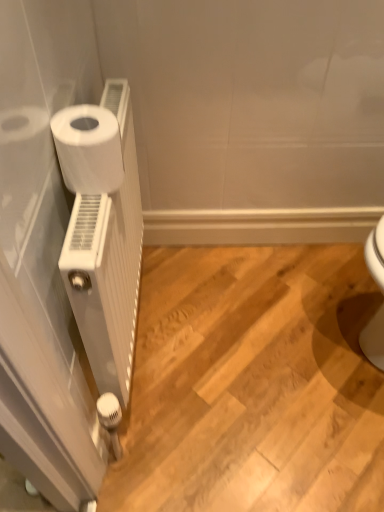
What do you see at coordinates (103, 231) in the screenshot? I see `white matte radiator at left` at bounding box center [103, 231].

What do you see at coordinates (42, 254) in the screenshot? I see `white matte radiator at left` at bounding box center [42, 254].

Locate an element on the screen. This screenshot has height=512, width=384. white matte toilet paper at left is located at coordinates (88, 149).

Considering the relative positions of white matte toilet paper at left and white matte radiator at left in the image provided, is white matte toilet paper at left to the left of white matte radiator at left from the viewer's perspective?

Correct, you'll find white matte toilet paper at left to the left of white matte radiator at left.

Consider the image. Is white matte toilet paper at left positioned with its back to white matte radiator at left?

No, white matte toilet paper at left is not facing away from white matte radiator at left.

Is white matte toilet paper at left bigger or smaller than white matte radiator at left?

Clearly, white matte toilet paper at left is smaller in size than white matte radiator at left.

Can you confirm if white matte toilet paper at left is bigger than white matte radiator at left?

No.

In terms of width, does white matte toilet paper at left look wider or thinner when compared to white matte radiator at left?

In the image, white matte toilet paper at left appears to be wider than white matte radiator at left.

Is white matte toilet paper at left located outside white matte radiator at left?

Yes.

Is white matte toilet paper at left closer to the viewer compared to white matte radiator at left?

No, it is behind white matte radiator at left.

From the image's perspective, is white matte radiator at left located beneath white matte radiator at left?

Yes, from the image's perspective, white matte radiator at left is below white matte radiator at left.

Is the surface of white matte radiator at left in direct contact with white matte radiator at left?

No.

Is white matte radiator at left at the back of white matte radiator at left?

Yes, white matte radiator at left is facing away from white matte radiator at left.

Which point is more distant from viewer, (83, 167) or (94, 48)?

The point (94, 48) is farther.

The height and width of the screenshot is (512, 384). In the image, there is a white matte radiator at left. What are the coordinates of `screen door above it (from the image's perspective)` in the screenshot? It's located at (42, 254).

Does white matte radiator at left have a greater width compared to white matte radiator at left?

In fact, white matte radiator at left might be narrower than white matte radiator at left.

Is white matte radiator at left oriented towards white matte radiator at left?

Yes.

Is white matte radiator at left not near white matte radiator at left?

No, there isn't a large distance between white matte radiator at left and white matte radiator at left.

Locate an element on the screen. The height and width of the screenshot is (512, 384). radiator on the right of white matte toilet paper at left is located at coordinates (103, 231).

Is white matte radiator at left far away from white matte toilet paper at left?

That's not correct — white matte radiator at left is a little close to white matte toilet paper at left.

Is white matte radiator at left taller or shorter than white matte toilet paper at left?

white matte radiator at left is taller than white matte toilet paper at left.

Can we say white matte radiator at left lies outside white matte toilet paper at left?

That's correct, white matte radiator at left is outside of white matte toilet paper at left.

Which is closer to the camera, [78,406] or [99,137]?

Point [78,406].

Is white matte radiator at left taller or shorter than white matte toilet paper at left?

Clearly, white matte radiator at left is taller compared to white matte toilet paper at left.

Is white matte radiator at left not close to white matte toilet paper at left?

No, white matte radiator at left is in close proximity to white matte toilet paper at left.

Is white matte radiator at left positioned behind white matte toilet paper at left?

No, it is not.

Identify the location of toilet paper located above the white matte radiator at left (from a real-world perspective). The image size is (384, 512). (88, 149).

Where is `screen door in front of the white matte toilet paper at left`? screen door in front of the white matte toilet paper at left is located at coordinates (42, 254).

From the image, which object appears to be nearer to white matte radiator at left, white matte radiator at left or white matte toilet paper at left?

The object closer to white matte radiator at left is white matte radiator at left.

Based on their spatial positions, is white matte toilet paper at left or white matte radiator at left further from white matte radiator at left?

Among the two, white matte toilet paper at left is located further to white matte radiator at left.

Estimate the real-world distances between objects in this image. Which object is closer to white matte radiator at left, white matte toilet paper at left or white matte radiator at left?

Among the two, white matte radiator at left is located nearer to white matte radiator at left.

Estimate the real-world distances between objects in this image. Which object is further from white matte toilet paper at left, white matte radiator at left or white matte radiator at left?

Among the two, white matte radiator at left is located further to white matte toilet paper at left.

Which object lies further to the anchor point white matte toilet paper at left, white matte radiator at left or white matte radiator at left?

Based on the image, white matte radiator at left appears to be further to white matte toilet paper at left.

Which object lies nearer to the anchor point white matte radiator at left, white matte radiator at left or white matte toilet paper at left?

Among the two, white matte radiator at left is located nearer to white matte radiator at left.

Locate an element on the screen. radiator positioned between white matte radiator at left and white matte toilet paper at left from near to far is located at coordinates (103, 231).